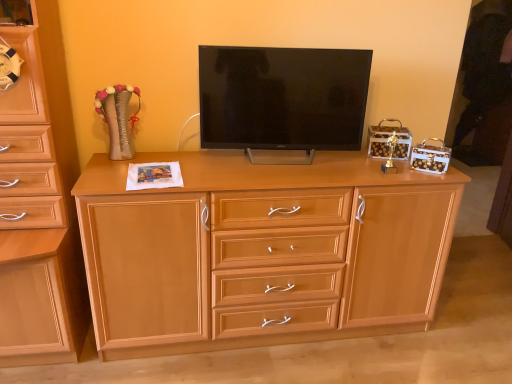
Question: Is matte black tv at center not within light wood chest of drawers at center, which is the second chest of drawers from left to right?

Choices:
 (A) no
 (B) yes

Answer: (B)

Question: Does matte black tv at center come behind light wood chest of drawers at center, which is the second chest of drawers from left to right?

Choices:
 (A) yes
 (B) no

Answer: (A)

Question: From the image's perspective, is matte black tv at center located beneath light wood chest of drawers at center, which is the second chest of drawers from left to right?

Choices:
 (A) no
 (B) yes

Answer: (A)

Question: Considering the relative positions of matte black tv at center and light wood chest of drawers at center, which is the second chest of drawers from left to right, in the image provided, is matte black tv at center to the right of light wood chest of drawers at center, which is the second chest of drawers from left to right, from the viewer's perspective?

Choices:
 (A) yes
 (B) no

Answer: (A)

Question: Is matte black tv at center turned away from light wood chest of drawers at center, which is the second chest of drawers from left to right?

Choices:
 (A) yes
 (B) no

Answer: (B)

Question: Does point (347, 147) appear closer or farther from the camera than point (45, 326)?

Choices:
 (A) farther
 (B) closer

Answer: (A)

Question: From a real-world perspective, is matte black tv at center above or below matte wood chest of drawers at left, the second chest of drawers viewed from the right?

Choices:
 (A) below
 (B) above

Answer: (B)

Question: Is matte black tv at center spatially inside matte wood chest of drawers at left, the 1th chest of drawers viewed from the left, or outside of it?

Choices:
 (A) inside
 (B) outside

Answer: (B)

Question: From their relative heights in the image, would you say matte black tv at center is taller or shorter than matte wood chest of drawers at left, the 1th chest of drawers viewed from the left?

Choices:
 (A) tall
 (B) short

Answer: (B)

Question: In terms of size, does light wood chest of drawers at center, which is the second chest of drawers from left to right, appear bigger or smaller than matte wood chest of drawers at left, the second chest of drawers viewed from the right?

Choices:
 (A) small
 (B) big

Answer: (B)

Question: Considering the positions of point (125, 249) and point (38, 87), is point (125, 249) closer or farther from the camera than point (38, 87)?

Choices:
 (A) farther
 (B) closer

Answer: (A)

Question: From a real-world perspective, relative to matte wood chest of drawers at left, the 1th chest of drawers viewed from the left, is light wood chest of drawers at center, which is the second chest of drawers from left to right, vertically above or below?

Choices:
 (A) below
 (B) above

Answer: (A)

Question: Considering the positions of light wood chest of drawers at center, which is the second chest of drawers from left to right, and matte wood chest of drawers at left, the second chest of drawers viewed from the right, in the image, is light wood chest of drawers at center, which is the second chest of drawers from left to right, wider or thinner than matte wood chest of drawers at left, the second chest of drawers viewed from the right,?

Choices:
 (A) thin
 (B) wide

Answer: (A)

Question: Is point (10, 261) positioned closer to the camera than point (285, 105)?

Choices:
 (A) closer
 (B) farther

Answer: (A)

Question: Is matte wood chest of drawers at left, the second chest of drawers viewed from the right, in front of or behind matte black tv at center in the image?

Choices:
 (A) behind
 (B) front

Answer: (B)